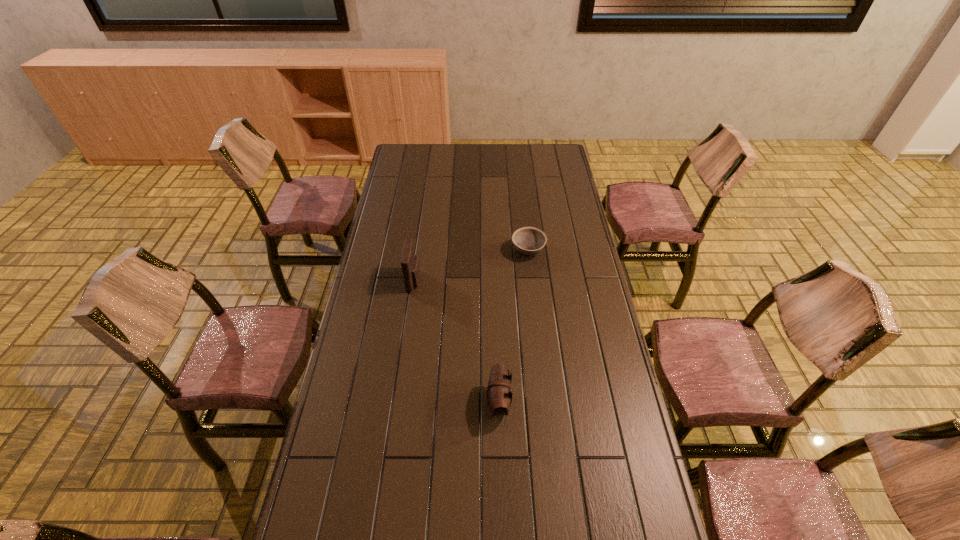
Locate an element on the screen. The width and height of the screenshot is (960, 540). unoccupied position between the second object from left to right and the left pouch is located at coordinates (456, 341).

Where is `free space between the farthest object and the left pouch`? This screenshot has height=540, width=960. free space between the farthest object and the left pouch is located at coordinates (471, 266).

I want to click on free space between the leftmost object and the shorter pouch, so click(x=456, y=341).

Where is `unoccupied area between the rightmost object and the shorter pouch`? The width and height of the screenshot is (960, 540). unoccupied area between the rightmost object and the shorter pouch is located at coordinates (514, 327).

I want to click on vacant point located between the tallest object and the nearer pouch, so click(x=456, y=341).

Where is `the second closest object to the leftmost object`? Image resolution: width=960 pixels, height=540 pixels. the second closest object to the leftmost object is located at coordinates (499, 392).

Select which object appears as the second closest to the shortest object. Please provide its 2D coordinates. Your answer should be formatted as a tuple, i.e. [(x, y)], where the tuple contains the x and y coordinates of a point satisfying the conditions above.

[(499, 392)]

Identify the location of free space that satisfies the following two spatial constraints: 1. on the front side of the bowl; 2. with an open flap on the farther pouch. The image size is (960, 540). (532, 280).

This screenshot has width=960, height=540. Find the location of `vacant position in the image that satisfies the following two spatial constraints: 1. on the front side of the farthest object; 2. with the flap open on the right pouch`. vacant position in the image that satisfies the following two spatial constraints: 1. on the front side of the farthest object; 2. with the flap open on the right pouch is located at coordinates click(x=545, y=402).